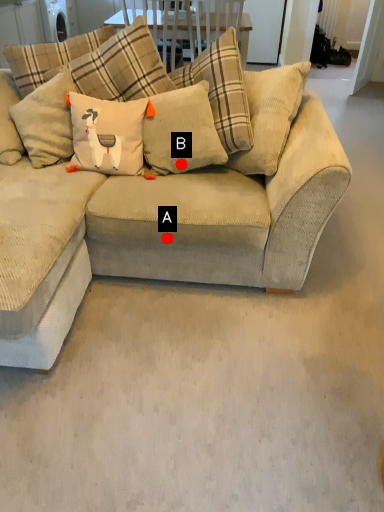
Question: Two points are circled on the image, labeled by A and B beside each circle. Which point is closer to the camera?

Choices:
 (A) A is closer
 (B) B is closer

Answer: (A)